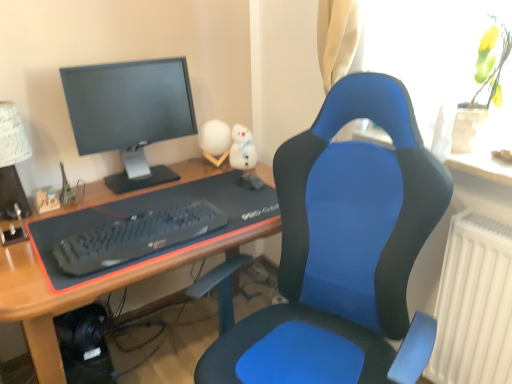
What are the coordinates of `free point below matte black monitor at upper left (from a real-world perspective)` in the screenshot? It's located at (139, 177).